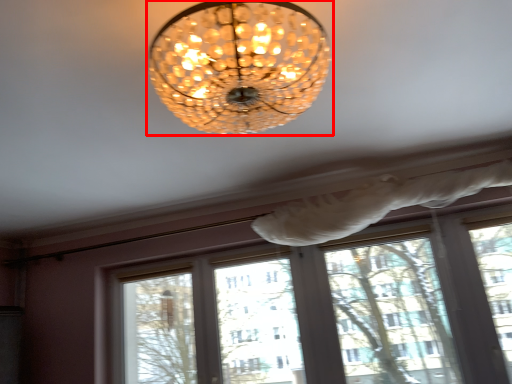
Question: In this image, where is lamp (annotated by the red box) located relative to window frame?

Choices:
 (A) right
 (B) left

Answer: (B)